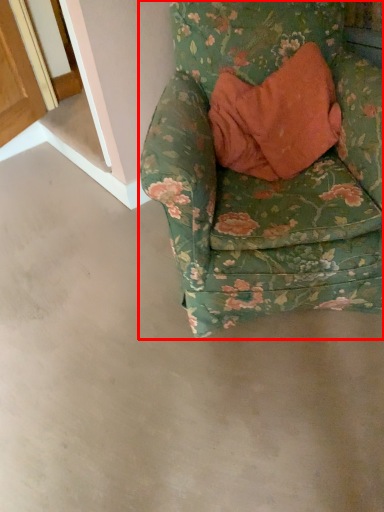
Question: From the image, what is the correct spatial relationship of chair (annotated by the red box) in relation to concrete?

Choices:
 (A) right
 (B) left

Answer: (A)